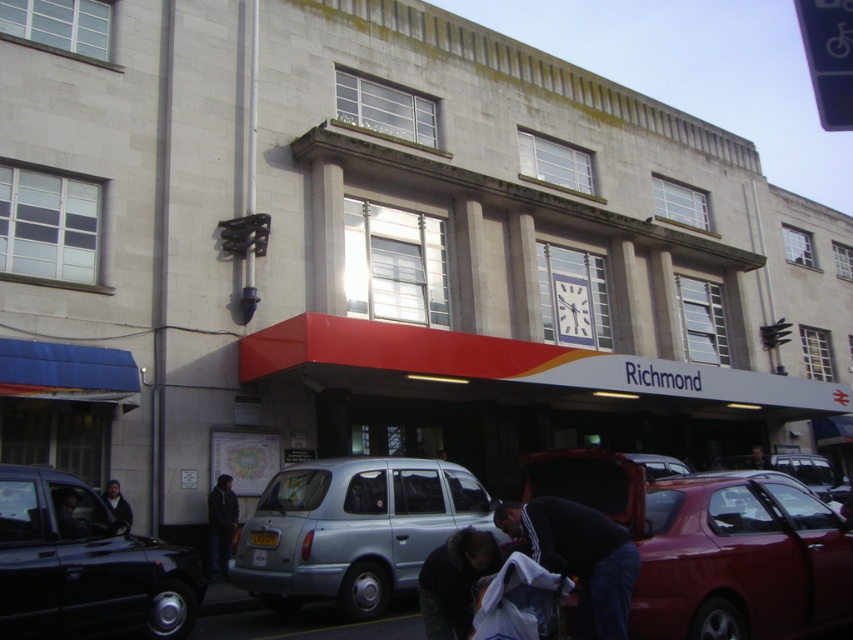
Does shiny red car at lower right have a smaller size compared to light blue metallic taxi at center?

Indeed, shiny red car at lower right has a smaller size compared to light blue metallic taxi at center.

Which is in front, point (779, 518) or point (364, 598)?

Point (779, 518)

Identify the location of shiny red car at lower right. (740, 561).

The height and width of the screenshot is (640, 853). What do you see at coordinates (740, 561) in the screenshot?
I see `shiny red car at lower right` at bounding box center [740, 561].

Can you confirm if shiny red car at lower right is shorter than dark gray jacket at lower left?

In fact, shiny red car at lower right may be taller than dark gray jacket at lower left.

Between point (753, 598) and point (114, 484), which one is positioned behind?

Positioned behind is point (114, 484).

The image size is (853, 640). What are the coordinates of `shiny red car at lower right` in the screenshot? It's located at (740, 561).

In the scene shown: Which is more to the right, matte black taxi at lower left or metallic red car at center?

From the viewer's perspective, metallic red car at center appears more on the right side.

What do you see at coordinates (84, 564) in the screenshot? I see `matte black taxi at lower left` at bounding box center [84, 564].

Is point (192, 556) farther from viewer compared to point (682, 465)?

No, (192, 556) is in front of (682, 465).

You are a GUI agent. You are given a task and a screenshot of the screen. Output one action in this format:
    pyautogui.click(x=<x>, y=<y>)
    Task: Click on the matte black taxi at lower left
    
    Given the screenshot: What is the action you would take?
    pyautogui.click(x=84, y=564)